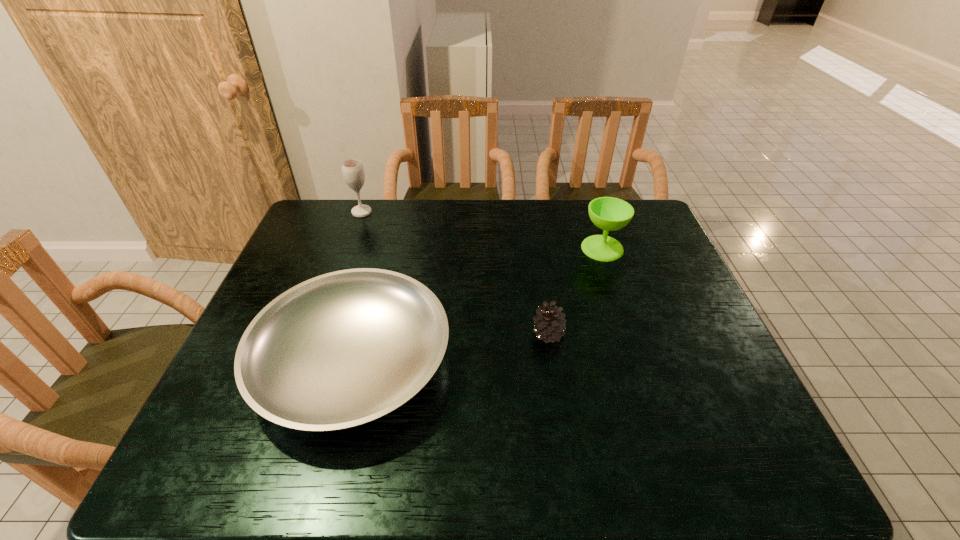
The width and height of the screenshot is (960, 540). I want to click on object that is positioned at the near edge, so click(x=340, y=350).

In order to click on wineglass located in the left edge section of the desktop in this screenshot , I will do `click(353, 172)`.

Locate an element on the screen. This screenshot has width=960, height=540. bedpan present at the left edge is located at coordinates (340, 350).

In order to click on object at the right edge in this screenshot , I will do `click(608, 213)`.

Locate an element on the screen. Image resolution: width=960 pixels, height=540 pixels. object that is at the far left corner is located at coordinates (353, 172).

Identify the location of object that is at the near left corner. (340, 350).

Locate an element on the screen. This screenshot has width=960, height=540. object present at the far right corner is located at coordinates (608, 213).

In the image, there is a desktop. Where is `vacant space at the far edge`? Image resolution: width=960 pixels, height=540 pixels. vacant space at the far edge is located at coordinates (467, 222).

Find the location of a particular element. The height and width of the screenshot is (540, 960). blank area at the near edge is located at coordinates (263, 472).

The height and width of the screenshot is (540, 960). I want to click on vacant area at the left edge, so click(299, 274).